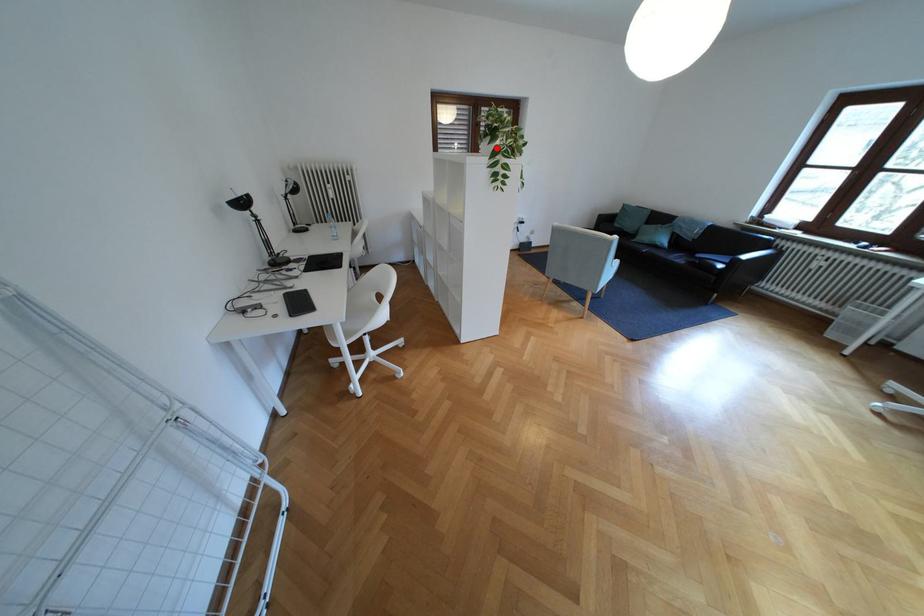
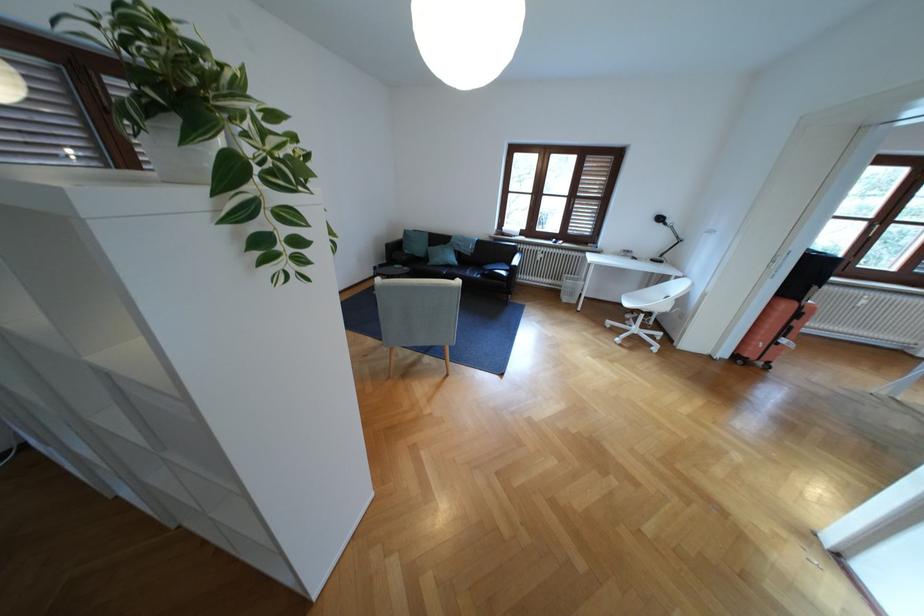
Question: I am providing you with two images of the same scene from different viewpoints. Given a red point in image1, look at the same physical point in image2. Is it:

Choices:
 (A) Closer to the viewpoint
 (B) Farther from the viewpoint

Answer: (B)